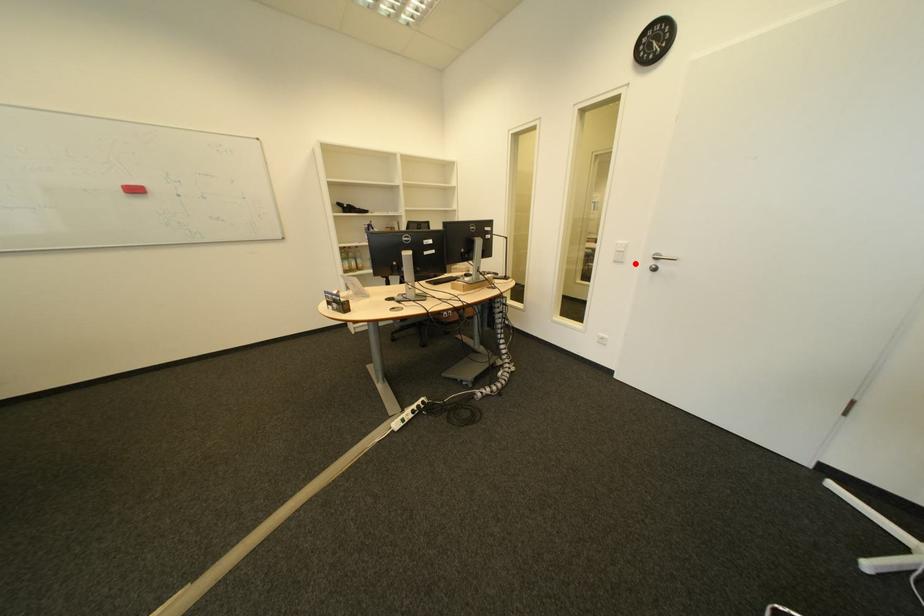
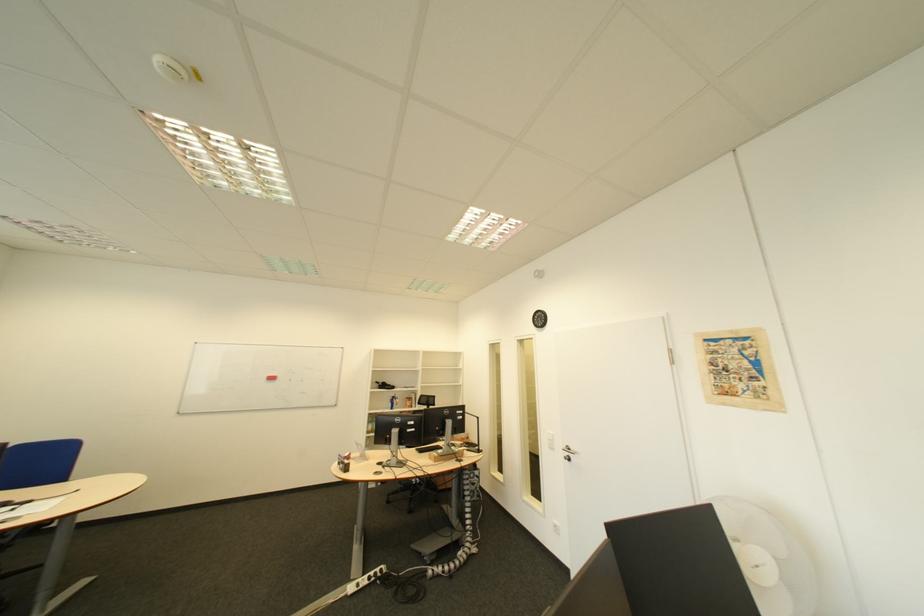
Question: A red point is marked in image1. In image2, is the corresponding 3D point closer to the camera or farther? Reply with the corresponding letter.

Choices:
 (A) The corresponding 3D point is closer.
 (B) The corresponding 3D point is farther.

Answer: (B)